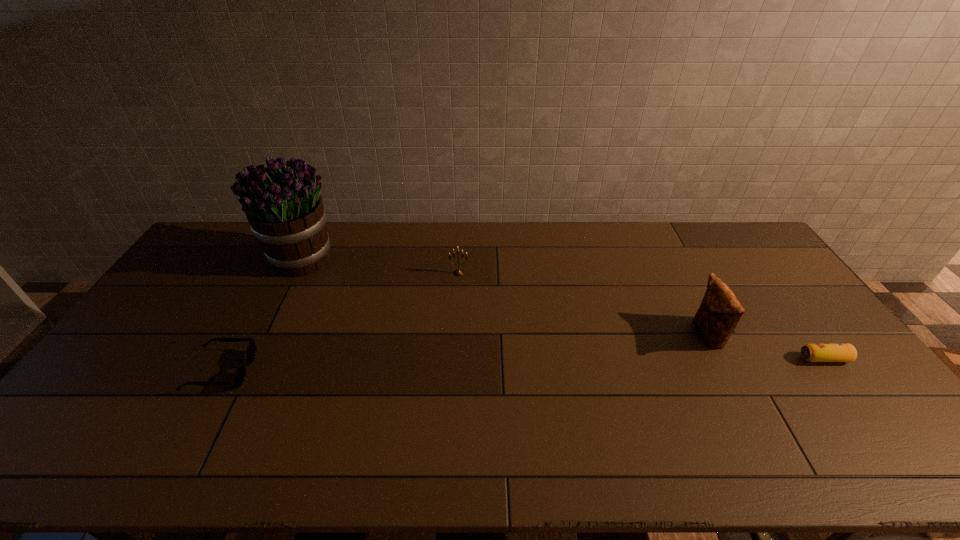
Where is `the tallest object`? the tallest object is located at coordinates (282, 203).

The width and height of the screenshot is (960, 540). Identify the location of the second tallest object. (719, 313).

Find the location of a particular element. Image resolution: width=960 pixels, height=540 pixels. clutch bag is located at coordinates (719, 313).

This screenshot has width=960, height=540. I want to click on the third shortest object, so click(x=458, y=272).

You are a GUI agent. You are given a task and a screenshot of the screen. Output one action in this format:
    pyautogui.click(x=<x>, y=<y>)
    Task: Click on the candelabrum
    The height and width of the screenshot is (540, 960).
    Given the screenshot: What is the action you would take?
    pyautogui.click(x=458, y=272)

The width and height of the screenshot is (960, 540). Identify the location of sunglasses. (238, 378).

Identify the location of beer can. (811, 352).

You are a GUI agent. You are given a task and a screenshot of the screen. Output one action in this format:
    pyautogui.click(x=<x>, y=<y>)
    Task: Click on the vacant region located on the right of the bouquet
    The width and height of the screenshot is (960, 540).
    Given the screenshot: What is the action you would take?
    pyautogui.click(x=419, y=258)

Identify the location of free space located 0.290m on the open side of the fourth shortest object. The height and width of the screenshot is (540, 960). (596, 335).

Identify the location of vacant area located 0.060m on the open side of the fourth shortest object. The width and height of the screenshot is (960, 540). (674, 335).